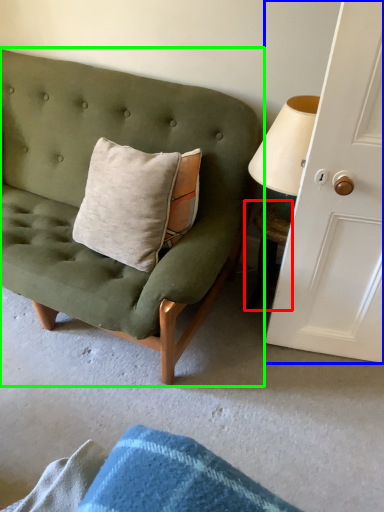
Question: Which object is the farthest from table (highlighted by a red box)? Choose among these: door (highlighted by a blue box) or studio couch (highlighted by a green box).

Choices:
 (A) door
 (B) studio couch

Answer: (B)